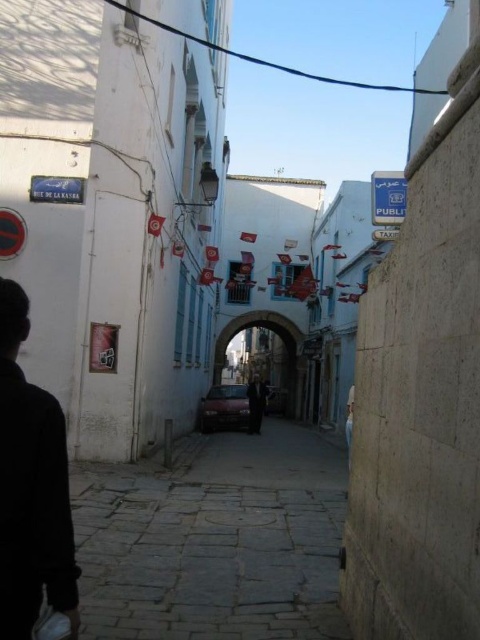
Does black matte jacket at lower left lie behind blue painted stone archway at center?

No.

Does black matte jacket at lower left have a smaller size compared to blue painted stone archway at center?

Yes, black matte jacket at lower left is smaller than blue painted stone archway at center.

Is point (55, 436) less distant than point (225, 332)?

Yes, point (55, 436) is closer to viewer.

The image size is (480, 640). In order to click on black matte jacket at lower left in this screenshot , I will do `click(31, 486)`.

Consider the image. Between black matte jacket at lower left and dark suit at center, which one appears on the right side from the viewer's perspective?

dark suit at center

Does black matte jacket at lower left appear on the left side of dark suit at center?

Indeed, black matte jacket at lower left is positioned on the left side of dark suit at center.

Find the location of `black matte jacket at lower left`. black matte jacket at lower left is located at coordinates (31, 486).

Image resolution: width=480 pixels, height=640 pixels. What do you see at coordinates (224, 406) in the screenshot? I see `matte red car at center` at bounding box center [224, 406].

Is the position of matte red car at center less distant than that of dark suit at center?

No, it is not.

Identify the location of matte red car at center. (224, 406).